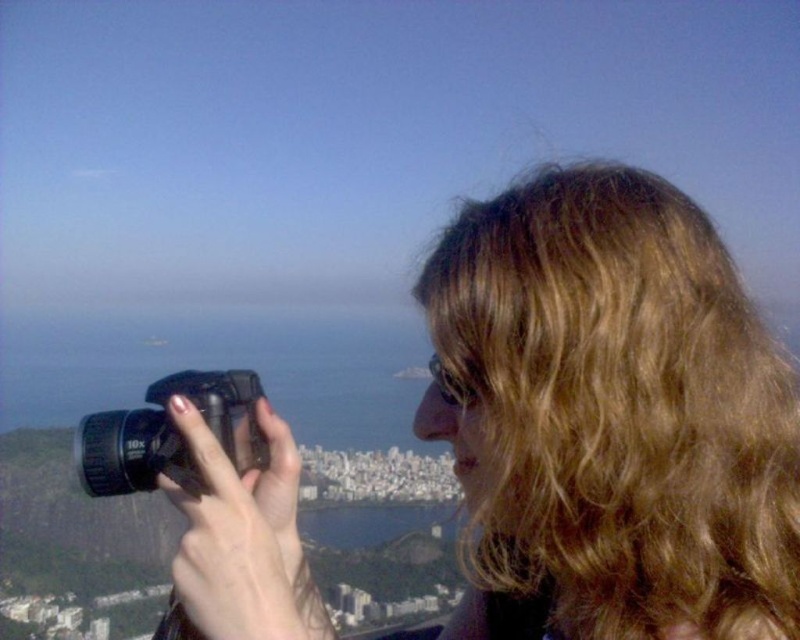
You are a photographer trying to capture the cityscape in the background. You notice the blonde curly hair at upper right and the black plastic camera at center in your frame. Which object is taller in the image?

The blonde curly hair at upper right is taller than the black plastic camera at center in the image.

You are a drone operator trying to capture a photo of the blonde curly hair at upper right and the camera. The drone can only focus on objects within 1000 feet. Will the drone be able to capture both objects in focus?

The blonde curly hair at upper right and camera are 1337.75 feet apart from each other. Since the distance between them exceeds the drone camera focus range of 1000 feet, the drone will not be able to capture both objects in focus.